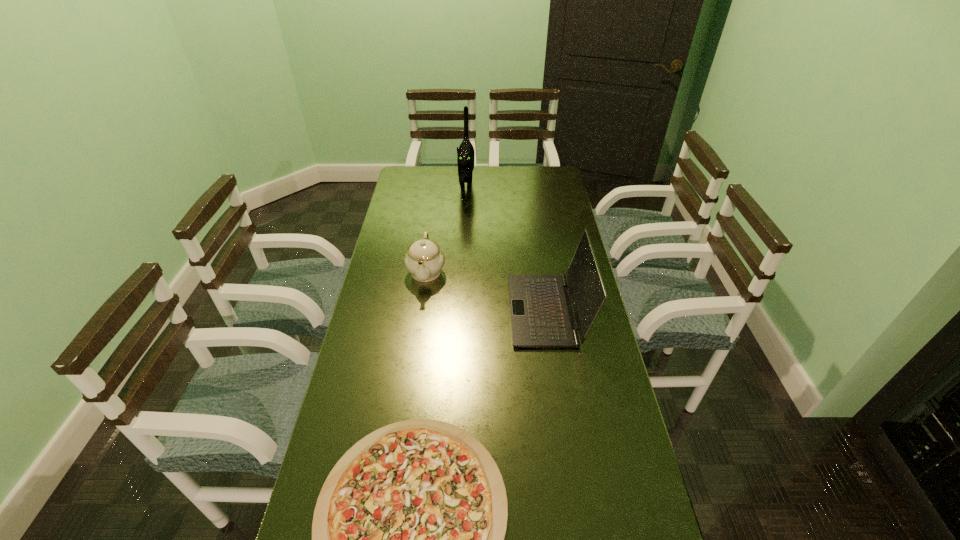
This screenshot has height=540, width=960. I want to click on the tallest object, so click(x=465, y=153).

This screenshot has height=540, width=960. I want to click on cat, so click(465, 153).

Locate an element on the screen. the rightmost object is located at coordinates (542, 316).

Find the location of a particular element. laptop computer is located at coordinates (542, 316).

The image size is (960, 540). What are the coordinates of `the second shortest object` in the screenshot? It's located at (424, 259).

The image size is (960, 540). Find the location of `vacant region located on the face of the cat`. vacant region located on the face of the cat is located at coordinates (466, 215).

The width and height of the screenshot is (960, 540). What are the coordinates of `free space located 0.200m on the screen of the second tallest object` in the screenshot? It's located at (450, 310).

Identify the location of free location located on the screen of the second tallest object. Image resolution: width=960 pixels, height=540 pixels. pyautogui.click(x=438, y=310).

The image size is (960, 540). Find the location of `free location located 0.330m on the screen of the second tallest object`. free location located 0.330m on the screen of the second tallest object is located at coordinates (411, 310).

The height and width of the screenshot is (540, 960). What are the coordinates of `blank area located 0.110m at the spout of the chinaware` in the screenshot? It's located at (420, 315).